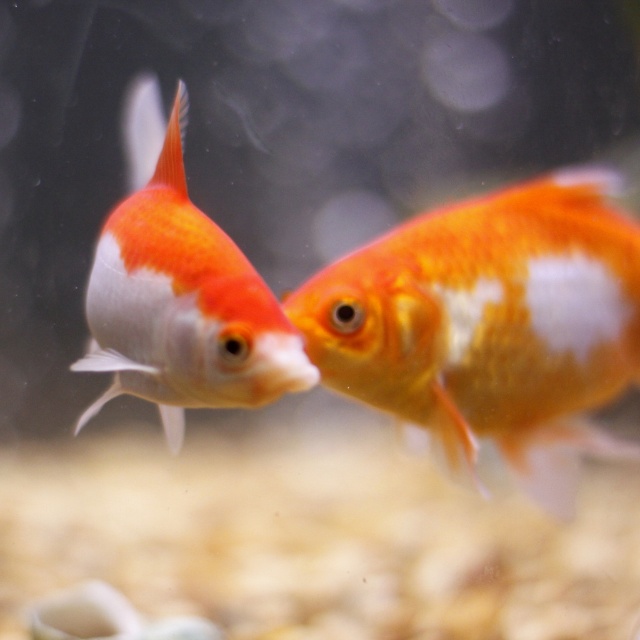
Question: Is shiny orange and white goldfish at center above shiny orange and white fish at left?

Choices:
 (A) yes
 (B) no

Answer: (B)

Question: Is shiny orange and white goldfish at center below shiny orange and white fish at left?

Choices:
 (A) no
 (B) yes

Answer: (B)

Question: Which object is farther from the camera taking this photo?

Choices:
 (A) shiny orange and white fish at left
 (B) shiny orange and white goldfish at center

Answer: (B)

Question: Is shiny orange and white goldfish at center to the left of shiny orange and white fish at left from the viewer's perspective?

Choices:
 (A) yes
 (B) no

Answer: (B)